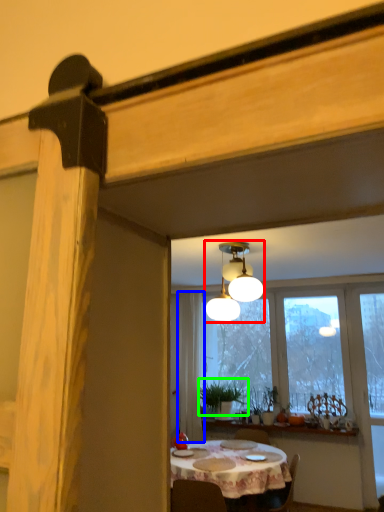
Question: Which object is the closest to the lamp (highlighted by a red box)? Choose among these: curtain (highlighted by a blue box) or plant (highlighted by a green box).

Choices:
 (A) curtain
 (B) plant

Answer: (A)